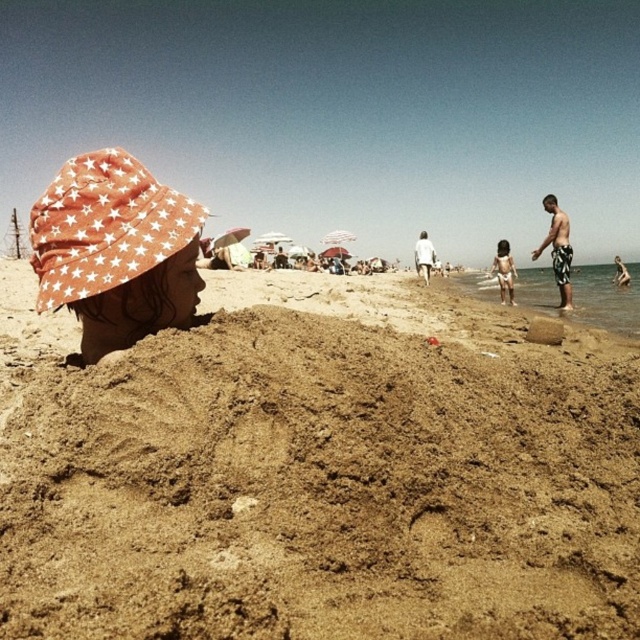
Looking at this image, you are a photographer trying to capture a closeup shot of the black and white striped shorts at right and the light gray fabric shorts at center. Since you want to focus on both, which pair of shorts should you zoom in on first to ensure they are both in frame?

The black and white striped shorts at right are wider than the light gray fabric shorts at center, so you should zoom in on the light gray fabric shorts at center first to ensure both are in frame.

You are planning to build a sandcastle on the beach. You have a bucket that can hold 2 liters of sand. The brown sandy mound at lower center is 1 meter wide and the black and white striped shorts at right are 1.5 meters wide. Which area would require more buckets to collect enough sand for the base of your sandcastle?

The black and white striped shorts at right is wider than the brown sandy mound at lower center, so you would need more buckets to collect enough sand from the black and white striped shorts at right area for the base of your sandcastle.